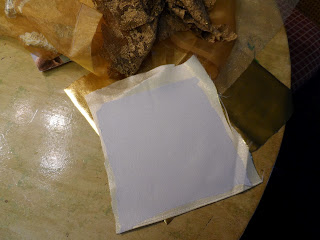
The height and width of the screenshot is (240, 320). In order to click on fabric in this screenshot , I will do coord(129,42), coord(199,13), coord(140,13), coord(62,32).